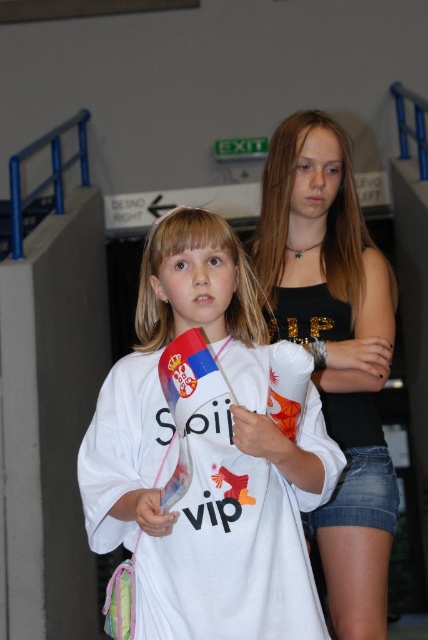
You are a photographer taking a picture of the two people in the scene. Which clothing item will appear larger in the photo, the white cotton shirt at center or the black matte tank top at center?

The white cotton shirt at center will appear larger in the photo because it is closer to the viewer than the black matte tank top at center.

In the scene shown: You are a photographer trying to capture a clear shot of the white cotton shirt at center. Based on its position coordinates, where should you aim your camera?

The white cotton shirt at center is located at coordinates point (207, 458), so aim your camera there to capture it clearly.